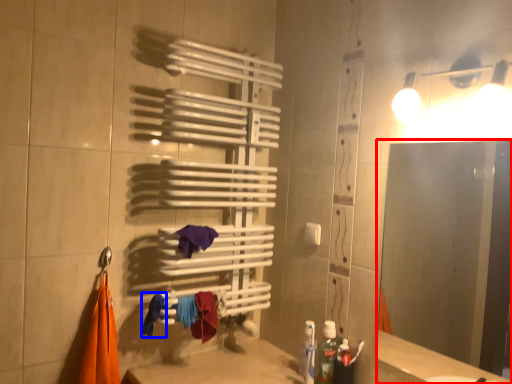
Question: Which object appears farthest to the camera in this image, mirror (highlighted by a red box) or clothe (highlighted by a blue box)?

Choices:
 (A) mirror
 (B) clothe

Answer: (B)